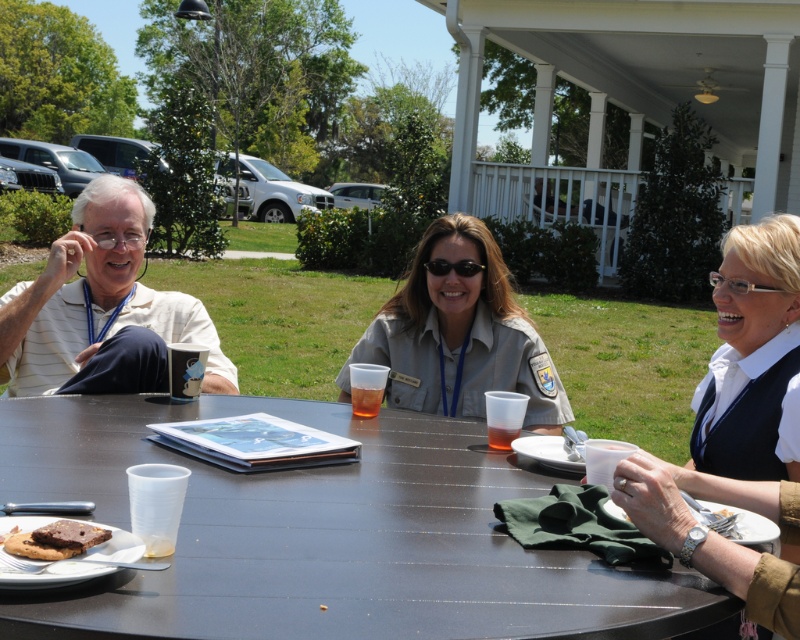
Question: Which of the following is the closest to the observer?

Choices:
 (A) (36, 308)
 (B) (494, 432)
 (C) (468, 234)
 (D) (26, 584)

Answer: (D)

Question: Does matte brownie at lower left appear on the left side of chocolate cake at lower left?

Choices:
 (A) no
 (B) yes

Answer: (B)

Question: Which of the following is the closest to the observer?

Choices:
 (A) chocolate cake at lower left
 (B) black plastic sunglasses at center

Answer: (A)

Question: Does black plastic table at center lie behind translucent plastic cup at table center?

Choices:
 (A) yes
 (B) no

Answer: (B)

Question: Is matte brownie at lower left closer to the viewer compared to chocolate cake at lower left?

Choices:
 (A) no
 (B) yes

Answer: (B)

Question: Which is farther from the translucent plastic cup at table center?

Choices:
 (A) white wooden porch at upper center
 (B) chocolate cake at lower left
 (C) khaki uniform at center

Answer: (A)